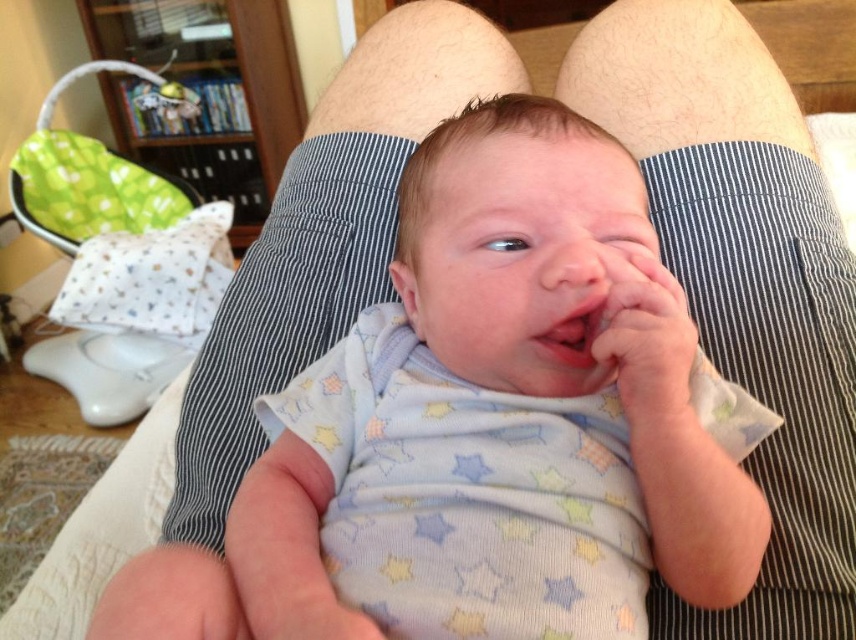
Question: Where is smooth skin hand at center located in relation to pink smooth lips at center in the image?

Choices:
 (A) below
 (B) above

Answer: (A)

Question: Does white soft fabric baby at center have a larger size compared to smooth skin hand at center?

Choices:
 (A) no
 (B) yes

Answer: (B)

Question: From the image, what is the correct spatial relationship of white soft fabric baby at center in relation to smooth skin hand at center?

Choices:
 (A) left
 (B) right

Answer: (A)

Question: Which object is closer to the camera taking this photo?

Choices:
 (A) pink smooth lips at center
 (B) smooth skin hand at center

Answer: (B)

Question: Which is nearer to the white soft fabric baby at center?

Choices:
 (A) smooth skin hand at center
 (B) pink smooth lips at center

Answer: (A)

Question: Which is farther from the pink smooth lips at center?

Choices:
 (A) white soft fabric baby at center
 (B) smooth skin hand at center

Answer: (A)